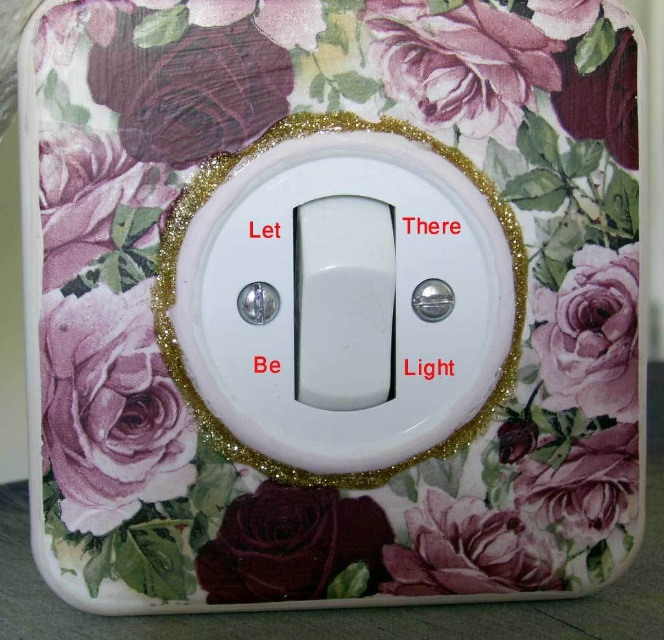
You are designing a wall decor layout and need to ensure proper spacing between the matte purple fabric rose at upper left and the white plastic light switch at center. Based on their sizes, which object should be placed closer to the bottom edge of the wall to maintain balance?

The matte purple fabric rose at upper left has a lesser height compared to the white plastic light switch at center. To maintain balance, the shorter matte purple fabric rose at upper left should be placed closer to the bottom edge of the wall so that its smaller size doesn

You are an interior designer assessing the placement of two decorative elements on a wall. The first element is at point (98, 481) and the second at point (169, 278). Given the scene described, which point is positioned closer to the viewer?

Point (98, 481) is closer to the viewer than point (169, 278).

You are trying to locate the light switch in a dark room. You see the matte purple fabric rose at upper left and the white plastic light switch at center. Which object is closer to you?

The matte purple fabric rose at upper left is closer to you because it is in front of the white plastic light switch at center.